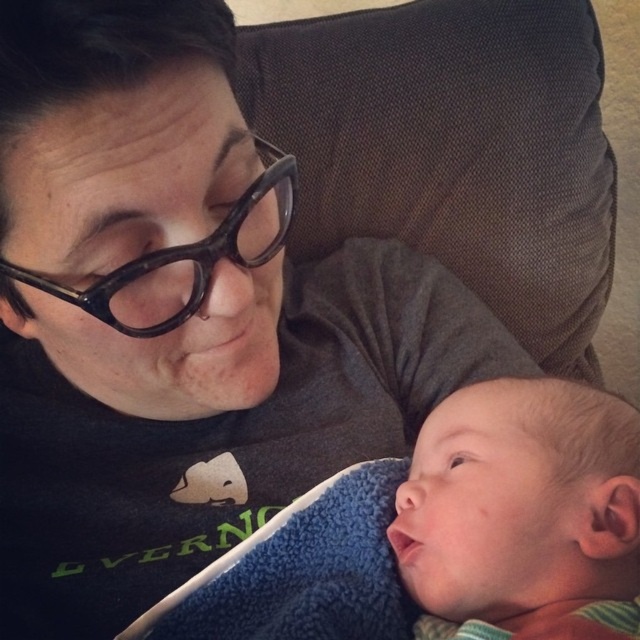
Can you confirm if smooth skin baby at center is taller than blue fleece blanket at lower right?

Yes, smooth skin baby at center is taller than blue fleece blanket at lower right.

Does smooth skin baby at center appear under blue fleece blanket at lower right?

No.

Who is more forward, (410, 545) or (349, 477)?

Point (410, 545)

Image resolution: width=640 pixels, height=640 pixels. What are the coordinates of `smooth skin baby at center` in the screenshot? It's located at (520, 500).